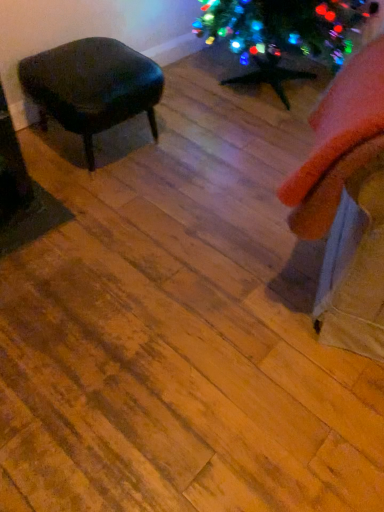
What do you see at coordinates (347, 204) in the screenshot? I see `orange fabric swivel chair at right` at bounding box center [347, 204].

This screenshot has height=512, width=384. What are the coordinates of `orange fabric swivel chair at right` in the screenshot? It's located at (347, 204).

This screenshot has height=512, width=384. Describe the element at coordinates (92, 87) in the screenshot. I see `matte black stool at left` at that location.

In order to click on matte black stool at left in this screenshot , I will do `click(92, 87)`.

In order to face matte black stool at left, should I rotate leftwards or rightwards?

It's best to rotate left around 12.932 degrees.

Measure the distance between matte black stool at left and camera.

matte black stool at left and camera are 4.81 feet apart.

The image size is (384, 512). Find the location of `orange fabric swivel chair at right`. orange fabric swivel chair at right is located at coordinates (347, 204).

Based on the photo, considering the positions of objects orange fabric swivel chair at right and matte black stool at left in the image provided, who is more to the left, orange fabric swivel chair at right or matte black stool at left?

matte black stool at left.

Looking at this image, which object is further away from the camera, orange fabric swivel chair at right or matte black stool at left?

matte black stool at left is further from the camera.

Is point (295, 210) closer or farther from the camera than point (51, 66)?

Point (295, 210) is positioned closer to the camera compared to point (51, 66).

From the image's perspective, is orange fabric swivel chair at right located above or below matte black stool at left?

Based on their image positions, orange fabric swivel chair at right is located beneath matte black stool at left.

From a real-world perspective, is orange fabric swivel chair at right on top of matte black stool at left?

Yes, from a real-world perspective, orange fabric swivel chair at right is over matte black stool at left

Considering the sizes of objects orange fabric swivel chair at right and matte black stool at left in the image provided, who is wider, orange fabric swivel chair at right or matte black stool at left?

Wider between the two is matte black stool at left.

Considering the sizes of objects orange fabric swivel chair at right and matte black stool at left in the image provided, who is taller, orange fabric swivel chair at right or matte black stool at left?

orange fabric swivel chair at right is taller.

Between orange fabric swivel chair at right and matte black stool at left, which one has larger size?

matte black stool at left.

Would you say orange fabric swivel chair at right is outside matte black stool at left?

Yes, orange fabric swivel chair at right is located beyond the bounds of matte black stool at left.

Is orange fabric swivel chair at right directly adjacent to matte black stool at left?

No, orange fabric swivel chair at right is not in contact with matte black stool at left.

Is orange fabric swivel chair at right positioned with its back to matte black stool at left?

No, matte black stool at left is not at the back of orange fabric swivel chair at right.

How distant is orange fabric swivel chair at right from matte black stool at left?

orange fabric swivel chair at right and matte black stool at left are 34.58 inches apart.

Identify the location of stool above the orange fabric swivel chair at right (from the image's perspective). The height and width of the screenshot is (512, 384). (92, 87).

In the image, is matte black stool at left on the left side or the right side of orange fabric swivel chair at right?

From the image, it's evident that matte black stool at left is to the left of orange fabric swivel chair at right.

Which object is further away from the camera, matte black stool at left or orange fabric swivel chair at right?

matte black stool at left is further away from the camera.

Considering the points (93, 164) and (346, 274), which point is in front, point (93, 164) or point (346, 274)?

The point (346, 274) is closer to the camera.

Based on the photo, from the image's perspective, is matte black stool at left on top of orange fabric swivel chair at right?

Yes, from the image's perspective, matte black stool at left is on top of orange fabric swivel chair at right.

From a real-world perspective, does matte black stool at left stand above orange fabric swivel chair at right?

Incorrect, from a real-world perspective, matte black stool at left is lower than orange fabric swivel chair at right.

Which object is wider, matte black stool at left or orange fabric swivel chair at right?

matte black stool at left is wider.

Which of these two, matte black stool at left or orange fabric swivel chair at right, stands shorter?

matte black stool at left is shorter.

Based on their sizes in the image, would you say matte black stool at left is bigger or smaller than orange fabric swivel chair at right?

Clearly, matte black stool at left is larger in size than orange fabric swivel chair at right.

Is orange fabric swivel chair at right surrounded by matte black stool at left?

No, matte black stool at left does not contain orange fabric swivel chair at right.

Is matte black stool at left directly adjacent to orange fabric swivel chair at right?

matte black stool at left and orange fabric swivel chair at right are clearly separated.

Could you tell me if matte black stool at left is facing orange fabric swivel chair at right?

Yes, matte black stool at left is oriented towards orange fabric swivel chair at right.

How many degrees apart are the facing directions of matte black stool at left and orange fabric swivel chair at right?

The angle between the facing direction of matte black stool at left and the facing direction of orange fabric swivel chair at right is 67.7 degrees.

Measure the distance from matte black stool at left to orange fabric swivel chair at right.

matte black stool at left and orange fabric swivel chair at right are 87.84 centimeters apart.

I want to click on stool above the orange fabric swivel chair at right (from the image's perspective), so click(92, 87).

This screenshot has width=384, height=512. I want to click on swivel chair located below the matte black stool at left (from the image's perspective), so coord(347,204).

Locate an element on the screen. Image resolution: width=384 pixels, height=512 pixels. swivel chair that appears in front of the matte black stool at left is located at coordinates (347, 204).